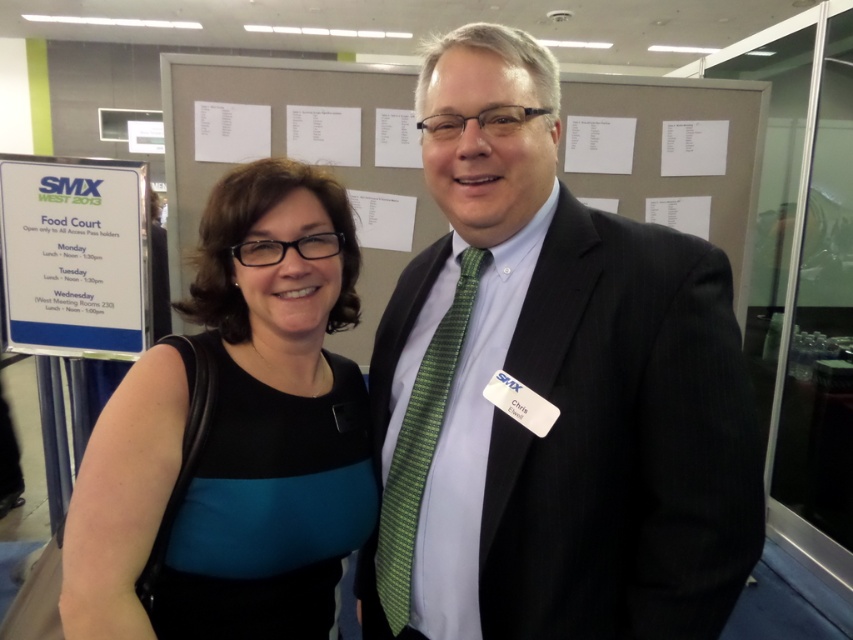
You are organizing a charity event and need to decide which item to place in a donation box. The black fabric dress at left and the green textured tie at center are available. Which item has a bigger size?

The black fabric dress at left has a larger size compared to the green textured tie at center, so the black fabric dress at left is bigger.

You are organizing a charity event and need to decide which outfit to display in the main showcase. The criteria is that the taller item should be placed in the showcase. Based on the scene description, which outfit should you choose between the dark gray suit at center and the black fabric dress at left?

The dark gray suit at center is taller than the black fabric dress at left, so you should choose the dark gray suit at center for the showcase.